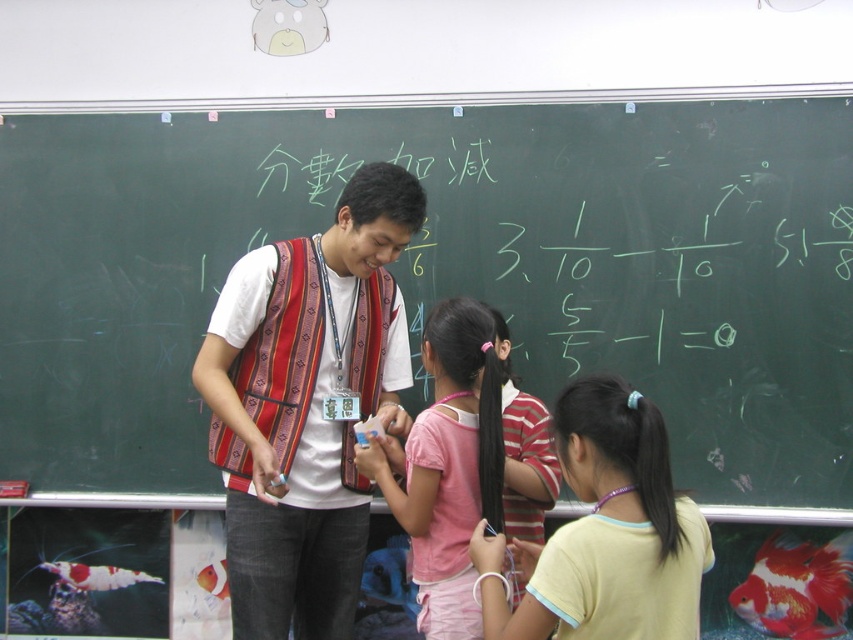
Looking at this image, what is the object located at the coordinates point [306,404] in the classroom scene?

The point [306,404] marks the striped fabric vest at center.

You are a teacher holding a 1.2 meter long ladder that needs to be placed between the green chalkboard at center and the yellow cotton shirt at lower right. Can the ladder fit horizontally between them?

The distance between the green chalkboard at center and the yellow cotton shirt at lower right is 1.06 meters. Since the ladder is 1.2 meters long, it cannot fit horizontally between them as the space is shorter than the ladder.